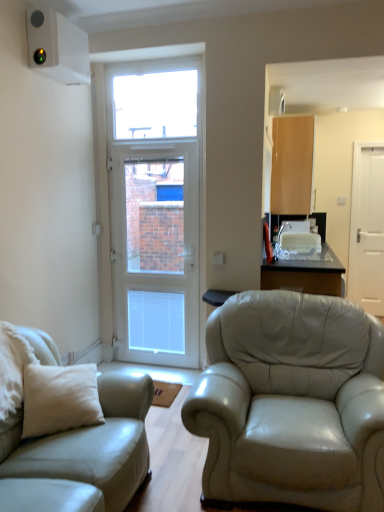
Question: Should I look upward or downward to see transparent glass window at upper center?

Choices:
 (A) up
 (B) down

Answer: (A)

Question: From the image's perspective, is white matte door at right, which appears as the first door when viewed from the back, located beneath transparent glass table at center?

Choices:
 (A) no
 (B) yes

Answer: (A)

Question: Is transparent glass table at center located within white matte door at right, which is the second door in left-to-right order?

Choices:
 (A) yes
 (B) no

Answer: (B)

Question: Can you confirm if white matte door at right, the 2th door when ordered from front to back, is smaller than transparent glass table at center?

Choices:
 (A) no
 (B) yes

Answer: (B)

Question: Is white matte door at right, which is the second door in left-to-right order, facing towards transparent glass table at center?

Choices:
 (A) yes
 (B) no

Answer: (B)

Question: Considering the relative sizes of white matte door at right, which appears as the first door when viewed from the back, and transparent glass table at center in the image provided, is white matte door at right, which appears as the first door when viewed from the back, taller than transparent glass table at center?

Choices:
 (A) no
 (B) yes

Answer: (B)

Question: Is the depth of white matte door at right, which appears as the first door when viewed from the back, less than that of transparent glass table at center?

Choices:
 (A) yes
 (B) no

Answer: (B)

Question: From the image's perspective, is transparent glass window at upper center under white matte door at right, which appears as the first door when viewed from the back?

Choices:
 (A) yes
 (B) no

Answer: (B)

Question: Considering the relative sizes of transparent glass window at upper center and white matte door at right, which is the second door in left-to-right order, in the image provided, is transparent glass window at upper center smaller than white matte door at right, which is the second door in left-to-right order,?

Choices:
 (A) yes
 (B) no

Answer: (A)

Question: Is transparent glass window at upper center wider than white matte door at right, the first door positioned from the right?

Choices:
 (A) no
 (B) yes

Answer: (A)

Question: Would you consider transparent glass window at upper center to be distant from white matte door at right, which appears as the first door when viewed from the back?

Choices:
 (A) no
 (B) yes

Answer: (B)

Question: From the image's perspective, is transparent glass window at upper center on top of white matte door at right, the 2th door when ordered from front to back?

Choices:
 (A) no
 (B) yes

Answer: (B)

Question: Is white matte door at right, the 2th door when ordered from front to back, surrounded by transparent glass window at upper center?

Choices:
 (A) yes
 (B) no

Answer: (B)

Question: Does white glossy door at center, the second door when ordered from right to left, lie in front of light beige leather couch at left?

Choices:
 (A) no
 (B) yes

Answer: (A)